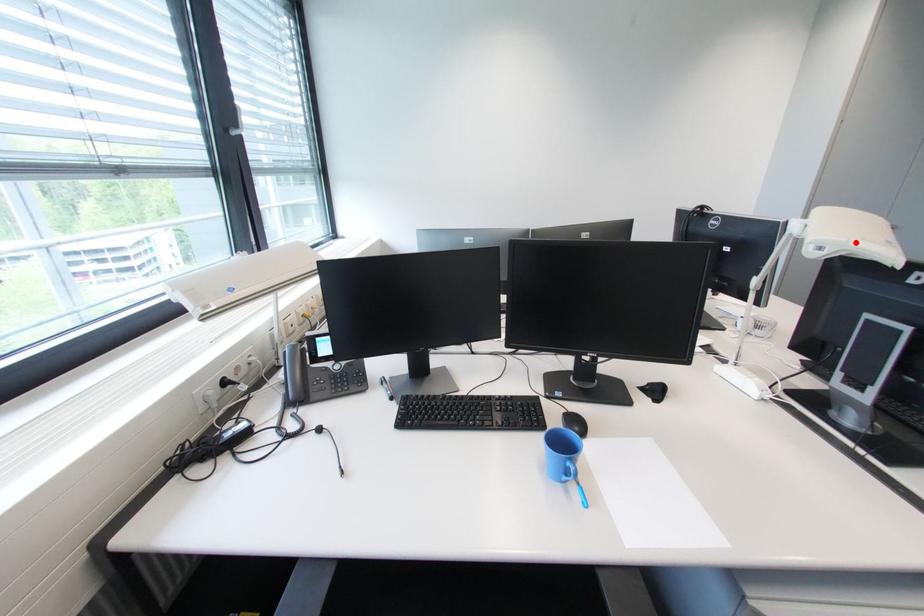
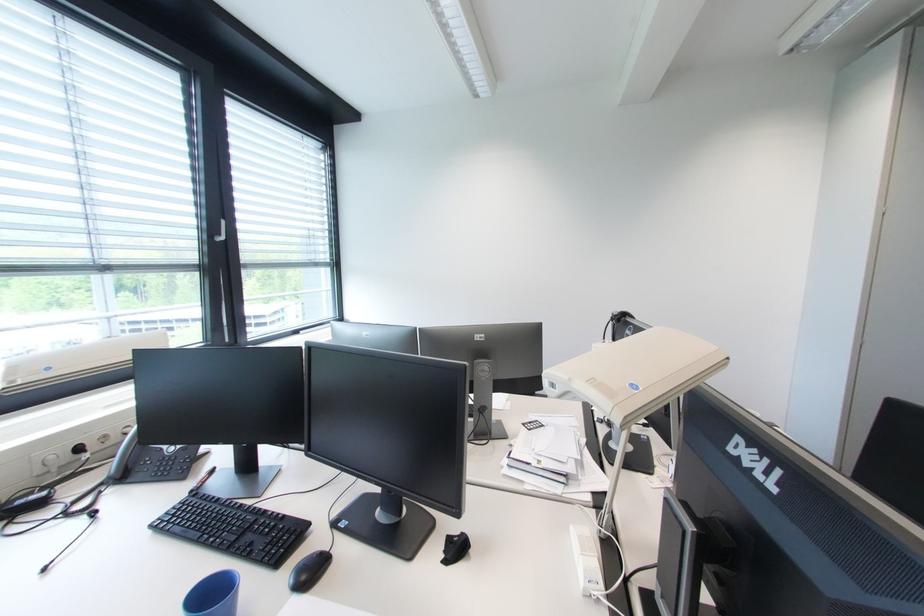
Find the pixel in the second image that matches the highlighted location in the first image.

(577, 381)